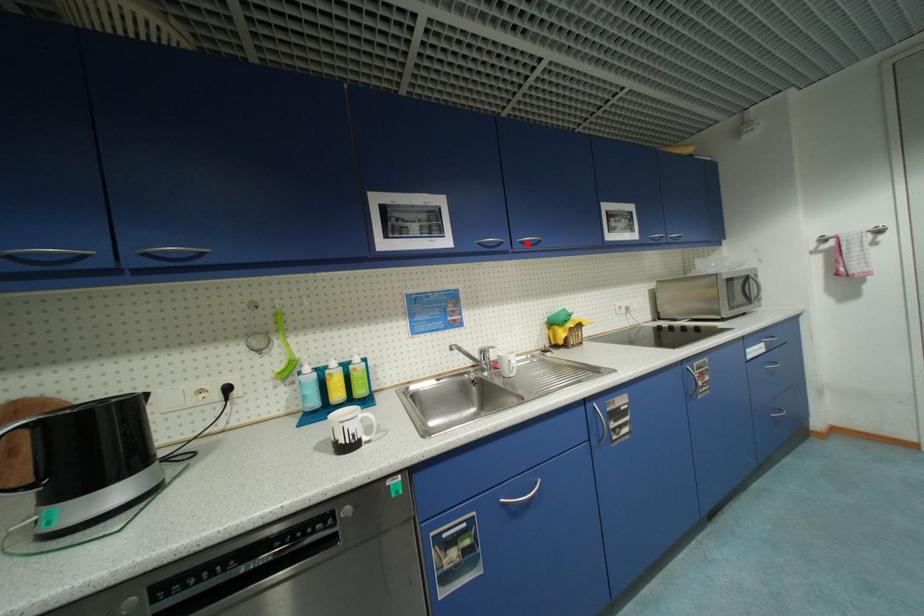
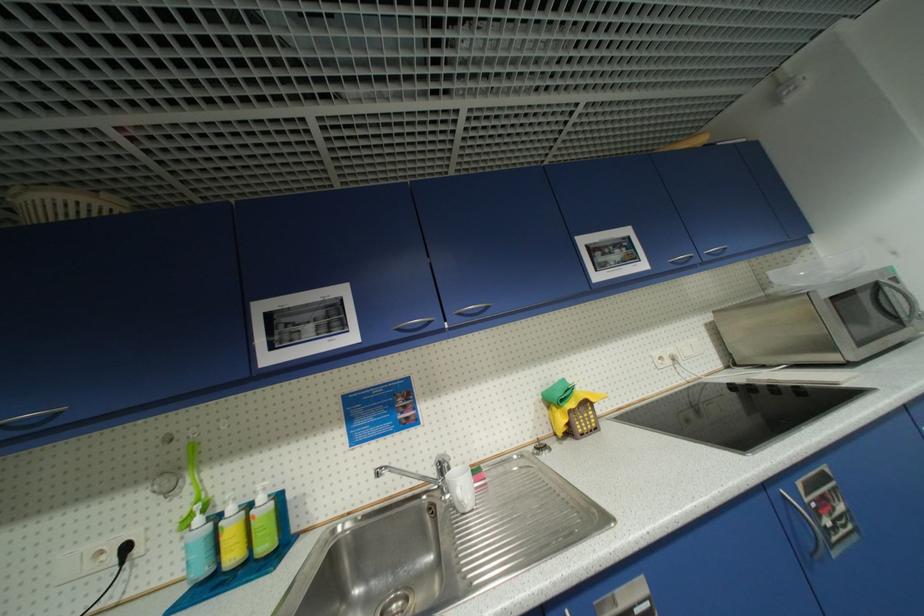
Find the pixel in the second image that matches the highlighted location in the first image.

(466, 315)